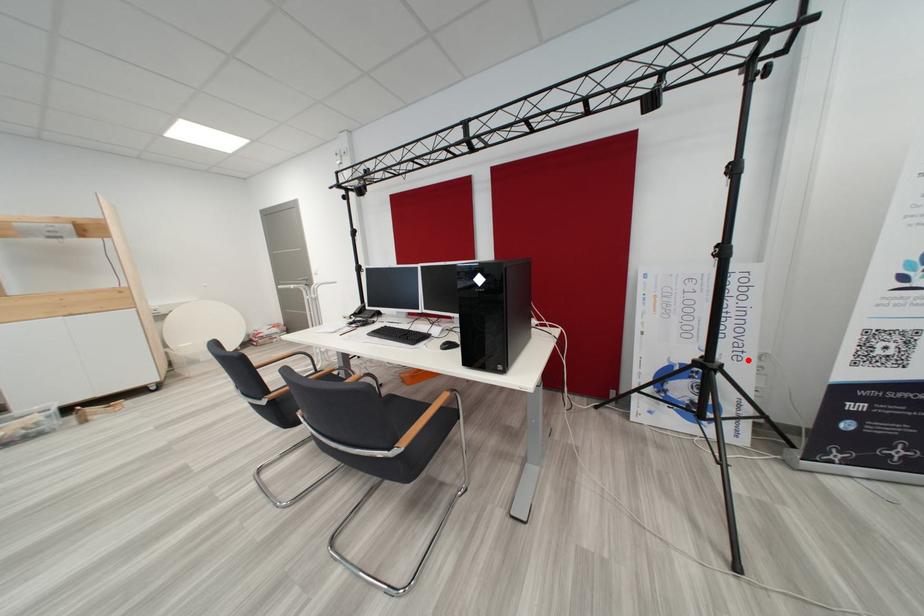
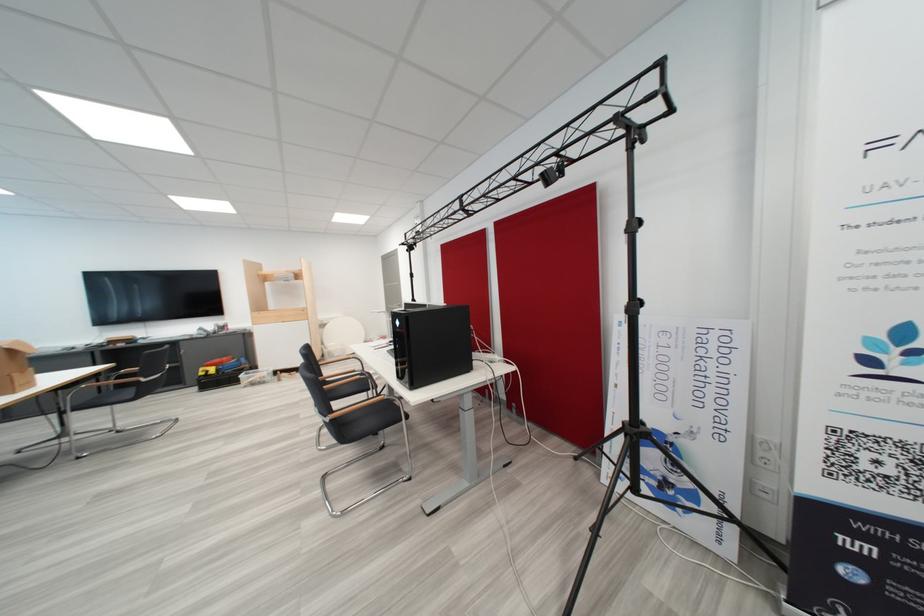
The point at the highlighted location is marked in the first image. Where is the corresponding point in the second image?

(731, 439)